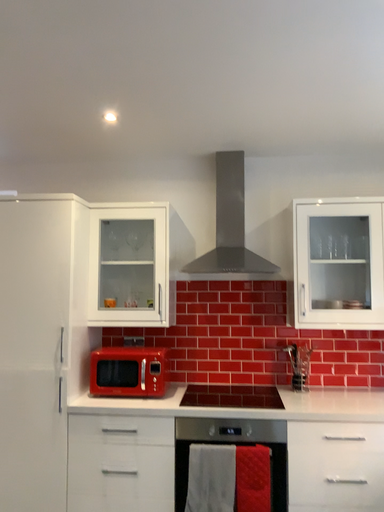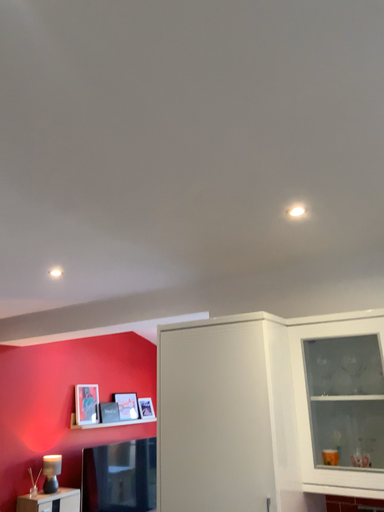
Question: How did the camera likely rotate when shooting the video?

Choices:
 (A) rotated left
 (B) rotated right

Answer: (A)